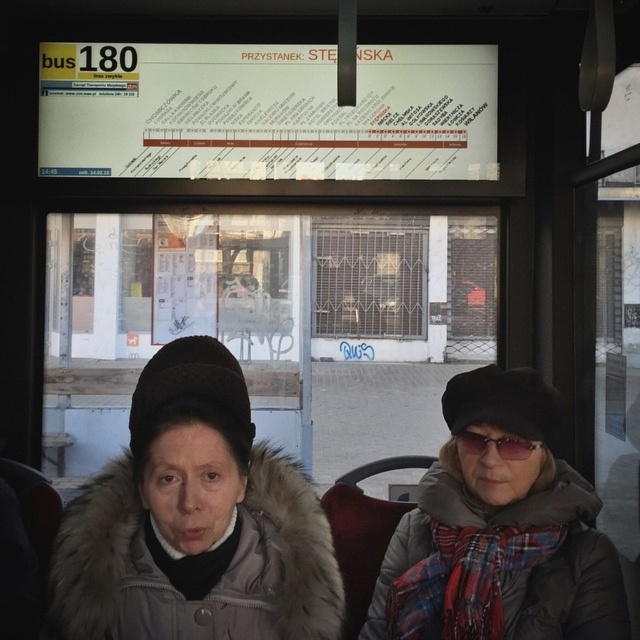
Question: Among these points, which one is nearest to the camera?

Choices:
 (A) (508, 442)
 (B) (132, 476)

Answer: (B)

Question: Which is nearer to the plaid scarf at center?

Choices:
 (A) sunglasses at center
 (B) fur-lined coat at center

Answer: (A)

Question: Does fur-lined coat at center appear on the right side of plaid scarf at center?

Choices:
 (A) yes
 (B) no

Answer: (B)

Question: Based on their relative distances, which object is nearer to the plaid scarf at center?

Choices:
 (A) sunglasses at center
 (B) fur-lined coat at center

Answer: (A)

Question: Is plaid scarf at center positioned behind sunglasses at center?

Choices:
 (A) no
 (B) yes

Answer: (A)

Question: Does plaid scarf at center appear over sunglasses at center?

Choices:
 (A) no
 (B) yes

Answer: (A)